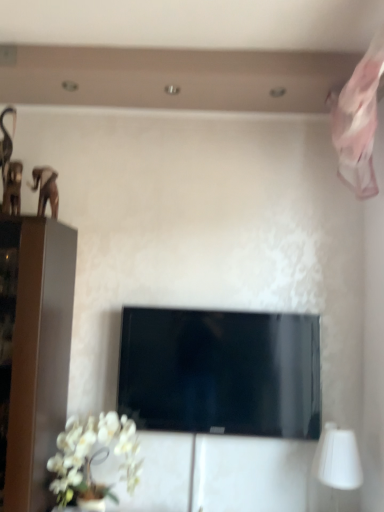
Question: Should I look upward or downward to see white matte table lamp at lower right?

Choices:
 (A) down
 (B) up

Answer: (A)

Question: Can you confirm if white matte table lamp at lower right is smaller than white matte orchid at lower left?

Choices:
 (A) no
 (B) yes

Answer: (B)

Question: From a real-world perspective, does white matte table lamp at lower right stand above white matte orchid at lower left?

Choices:
 (A) yes
 (B) no

Answer: (A)

Question: Does white matte table lamp at lower right appear on the right side of white matte orchid at lower left?

Choices:
 (A) yes
 (B) no

Answer: (A)

Question: Would you say white matte table lamp at lower right is a long distance from white matte orchid at lower left?

Choices:
 (A) no
 (B) yes

Answer: (A)

Question: Is white matte table lamp at lower right shorter than white matte orchid at lower left?

Choices:
 (A) yes
 (B) no

Answer: (A)

Question: Does white matte table lamp at lower right come behind white matte orchid at lower left?

Choices:
 (A) no
 (B) yes

Answer: (B)

Question: From a real-world perspective, is white matte table lamp at lower right under black glossy tv at center?

Choices:
 (A) yes
 (B) no

Answer: (A)

Question: Is white matte table lamp at lower right further to camera compared to black glossy tv at center?

Choices:
 (A) no
 (B) yes

Answer: (A)

Question: Is white matte table lamp at lower right to the right of black glossy tv at center from the viewer's perspective?

Choices:
 (A) yes
 (B) no

Answer: (A)

Question: Is white matte table lamp at lower right in front of black glossy tv at center?

Choices:
 (A) yes
 (B) no

Answer: (A)

Question: Considering the relative sizes of white matte table lamp at lower right and black glossy tv at center in the image provided, is white matte table lamp at lower right wider than black glossy tv at center?

Choices:
 (A) no
 (B) yes

Answer: (B)

Question: Is white matte table lamp at lower right outside of black glossy tv at center?

Choices:
 (A) yes
 (B) no

Answer: (A)

Question: From the image's perspective, is white matte orchid at lower left located beneath black glossy tv at center?

Choices:
 (A) yes
 (B) no

Answer: (A)